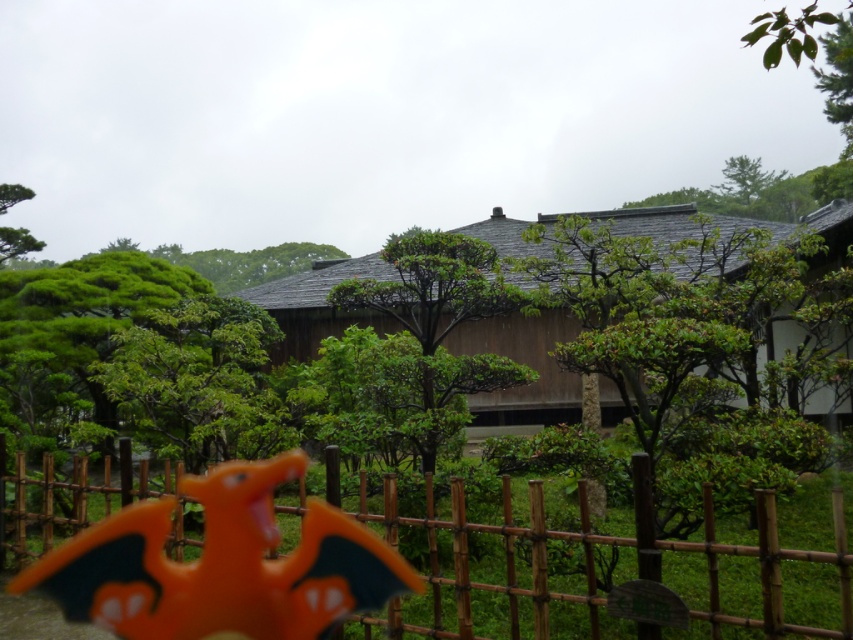
You are standing in front of the traditional building and want to reach the point marked at coordinates (103, 602). Considering the wooden fence in the foreground, can you walk directly to that point without going around the fence?

The point marked at coordinates (103, 602) is 15.61 feet away from the viewer. Since the wooden fence is in the foreground, it is likely blocking the direct path to the point. Therefore, you would need to go around the fence to reach it.

You are a visitor standing in front of the brown wooden hut at center and the green leafy tree at upper center. Which object is taller?

The brown wooden hut at center is much taller than the green leafy tree at upper center.

You are planning to build a small garden shed in your backyard. You want to ensure it fits within the space allocated. Based on the image, which object between the brown wooden hut at center and the green leafy tree at upper center has a greater width?

The brown wooden hut at center might be wider than green leafy tree at upper center according to the description.